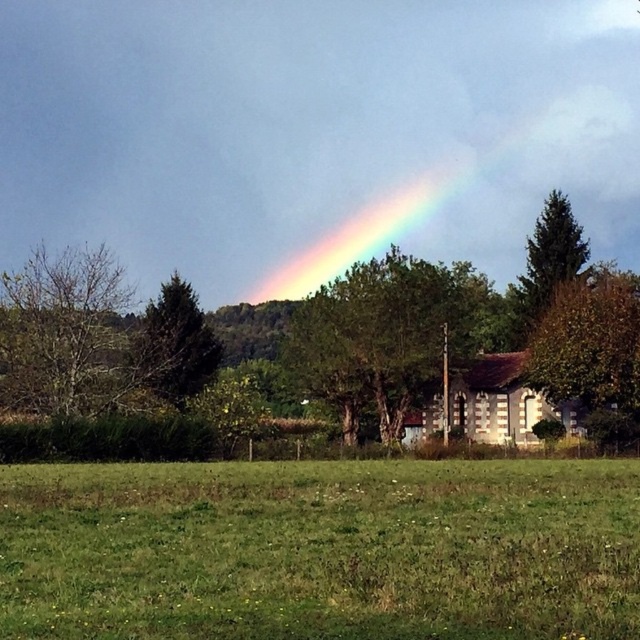
Who is lower down, green grass at lower center or rainbow at upper center?

green grass at lower center is below.

Measure the distance between point (636,464) and camera.

32.07 meters

The image size is (640, 640). Identify the location of green grass at lower center. (321, 548).

Between point (388, 417) and point (49, 396), which one is positioned behind?

Point (388, 417)

Between green leafy tree at center and bare branches at left, which one is positioned lower?

green leafy tree at center is lower down.

Image resolution: width=640 pixels, height=640 pixels. What do you see at coordinates (381, 337) in the screenshot?
I see `green leafy tree at center` at bounding box center [381, 337].

The width and height of the screenshot is (640, 640). Identify the location of green leafy tree at center. (381, 337).

Who is higher up, green grass at lower center or green matte tree at left?

green matte tree at left

Which is more to the right, green grass at lower center or green matte tree at left?

Positioned to the right is green grass at lower center.

Locate an element on the screen. The height and width of the screenshot is (640, 640). green grass at lower center is located at coordinates (321, 548).

The width and height of the screenshot is (640, 640). Find the location of `green grass at lower center`. green grass at lower center is located at coordinates (321, 548).